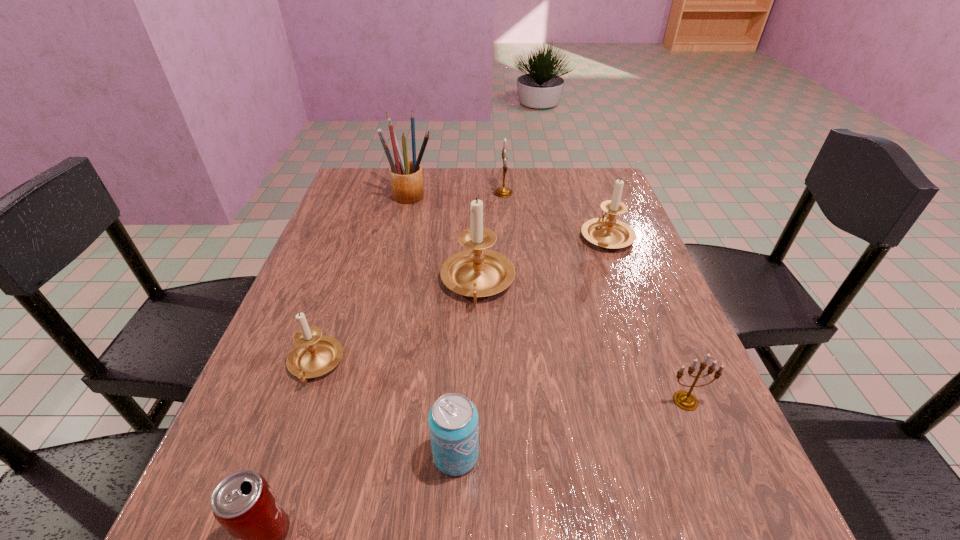
Where is `candelabrum object that ranks as the third closest to the second farthest candelabrum`? The width and height of the screenshot is (960, 540). candelabrum object that ranks as the third closest to the second farthest candelabrum is located at coordinates (685, 400).

Where is `beige candle holder that is the second nearest to the rightmost beige candle holder`? The height and width of the screenshot is (540, 960). beige candle holder that is the second nearest to the rightmost beige candle holder is located at coordinates (314, 355).

At what (x,y) coordinates should I click in order to perform the action: click on beige candle holder that is the closest to the pencil box. Please return your answer as a coordinate pair (x, y). Looking at the image, I should click on (476, 272).

You are a GUI agent. You are given a task and a screenshot of the screen. Output one action in this format:
    pyautogui.click(x=<x>, y=<y>)
    Task: Click on the vacant space that satisfies the following two spatial constraints: 1. on the back side of the farther gold candelabrum; 2. on the right side of the second nearest object
    The height and width of the screenshot is (540, 960).
    Given the screenshot: What is the action you would take?
    coord(468,193)

Find the location of `blank area in the image that satisfies the following two spatial constraints: 1. with a handle on the side of the leftmost candelabrum; 2. on the right side of the farther beer can`. blank area in the image that satisfies the following two spatial constraints: 1. with a handle on the side of the leftmost candelabrum; 2. on the right side of the farther beer can is located at coordinates (283, 455).

Find the location of `vacant area in the image that satisfies the following two spatial constraints: 1. on the front side of the second nearest object; 2. on the left side of the pencil box`. vacant area in the image that satisfies the following two spatial constraints: 1. on the front side of the second nearest object; 2. on the left side of the pencil box is located at coordinates (352, 455).